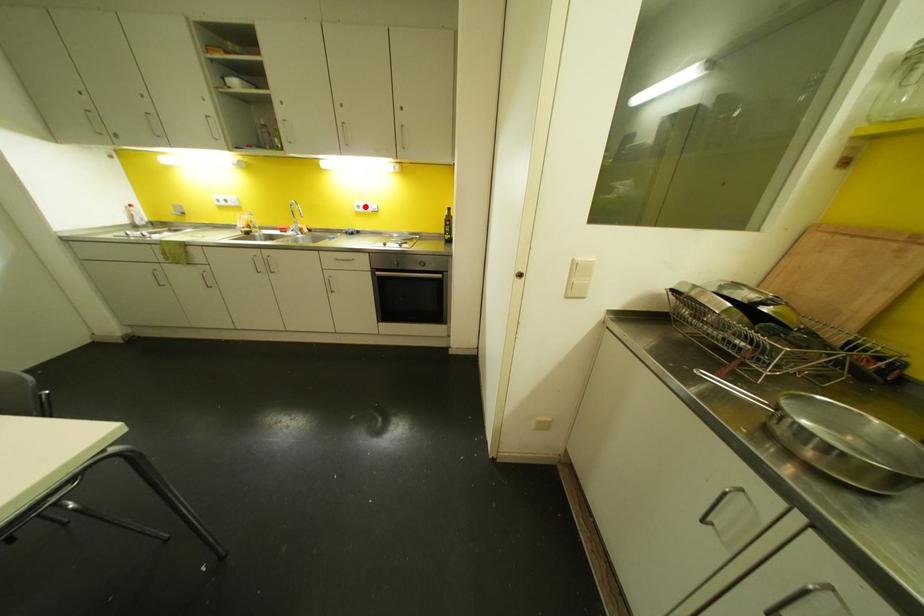
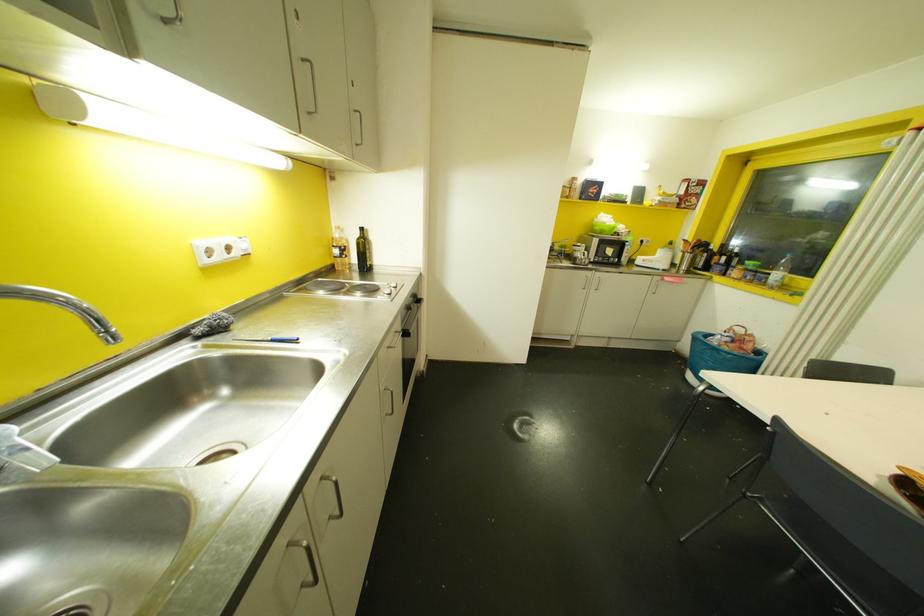
In the second image, find the point that corresponds to the highlighted location in the first image.

(227, 248)